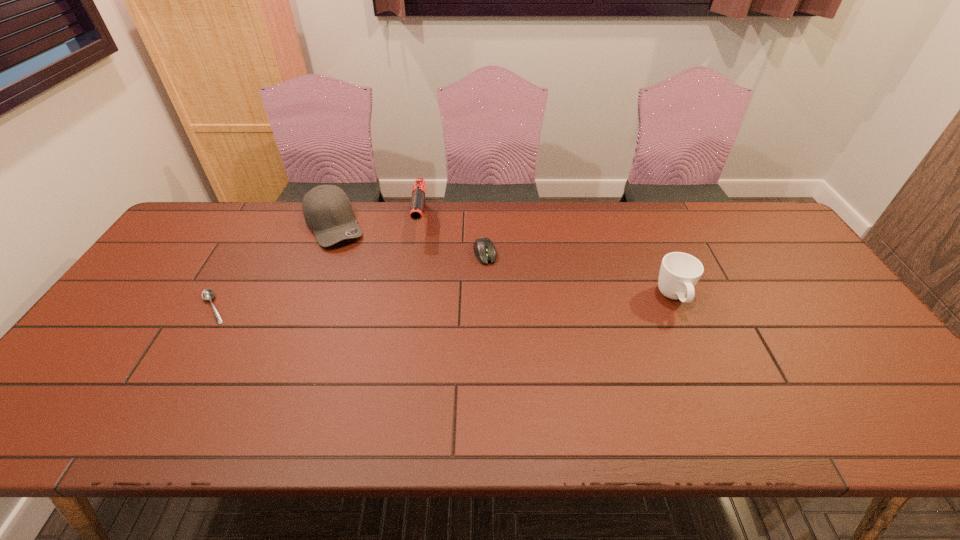
Locate an element on the screen. This screenshot has width=960, height=540. free space on the desktop that is between the soupspoon and the rightmost object and is positioned at the aiming end of the third object from right to left is located at coordinates (413, 303).

I want to click on vacant space on the desktop that is between the shortest object and the third tallest object and is positioned on the wheel side of the fourth object from left to right, so click(x=502, y=301).

In order to click on free spot on the desktop that is between the leftmost object and the cup and is positioned on the front brim of the fourth object from right to left in this screenshot , I will do `click(383, 304)`.